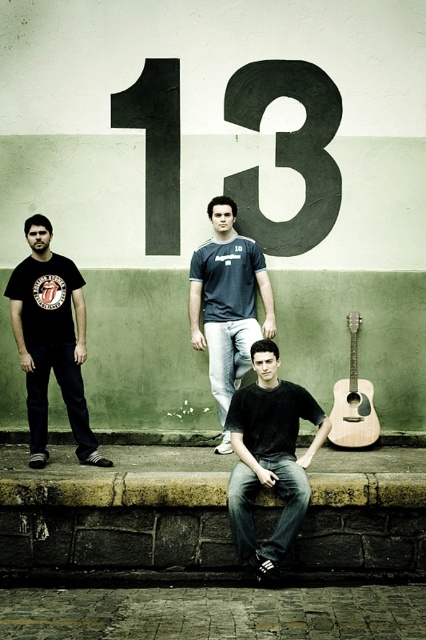
Question: Can you confirm if matte black t-shirt at left is positioned to the right of dark blue t-shirt at center?

Choices:
 (A) yes
 (B) no

Answer: (B)

Question: Which of these objects is positioned farthest from the matte black t-shirt at left?

Choices:
 (A) natural wood acoustic guitar at lower right
 (B) brown stone ledge at lower center

Answer: (A)

Question: Which of the following is the farthest from the observer?

Choices:
 (A) (206, 310)
 (B) (63, 484)

Answer: (A)

Question: Which object is farther from the camera taking this photo?

Choices:
 (A) brown stone ledge at lower center
 (B) dark blue t-shirt at center

Answer: (B)

Question: Is matte black t-shirt at left to the left of dark blue t-shirt at center from the viewer's perspective?

Choices:
 (A) yes
 (B) no

Answer: (A)

Question: Is dark blue t-shirt at center bigger than natural wood acoustic guitar at lower right?

Choices:
 (A) yes
 (B) no

Answer: (A)